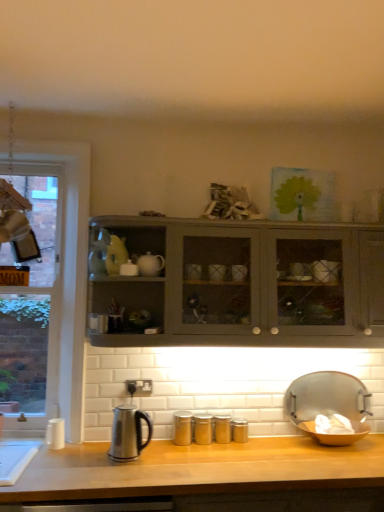
Question: Should I look upward or downward to see stainless steel kettle at lower left?

Choices:
 (A) down
 (B) up

Answer: (A)

Question: From the image's perspective, does matte gray cabinet at center appear higher than stainless steel kettle at lower left?

Choices:
 (A) yes
 (B) no

Answer: (A)

Question: Is the depth of matte gray cabinet at center less than that of stainless steel kettle at lower left?

Choices:
 (A) no
 (B) yes

Answer: (B)

Question: Is matte gray cabinet at center to the left of stainless steel kettle at lower left from the viewer's perspective?

Choices:
 (A) no
 (B) yes

Answer: (A)

Question: From the image's perspective, is matte gray cabinet at center below stainless steel kettle at lower left?

Choices:
 (A) yes
 (B) no

Answer: (B)

Question: Can you confirm if matte gray cabinet at center is wider than stainless steel kettle at lower left?

Choices:
 (A) yes
 (B) no

Answer: (A)

Question: From a real-world perspective, is matte gray cabinet at center on stainless steel kettle at lower left?

Choices:
 (A) yes
 (B) no

Answer: (A)

Question: Does clear glass window at left have a lesser width compared to matte gray cabinet at center?

Choices:
 (A) yes
 (B) no

Answer: (A)

Question: Is clear glass window at left closer to camera compared to matte gray cabinet at center?

Choices:
 (A) no
 (B) yes

Answer: (A)

Question: From a real-world perspective, is clear glass window at left physically above matte gray cabinet at center?

Choices:
 (A) yes
 (B) no

Answer: (B)

Question: Is clear glass window at left with matte gray cabinet at center?

Choices:
 (A) no
 (B) yes

Answer: (A)

Question: Is the depth of clear glass window at left greater than that of matte gray cabinet at center?

Choices:
 (A) yes
 (B) no

Answer: (A)

Question: Is clear glass window at left far from matte gray cabinet at center?

Choices:
 (A) no
 (B) yes

Answer: (A)

Question: Is metallic silver tray at lower right in contact with clear glass window at left?

Choices:
 (A) no
 (B) yes

Answer: (A)